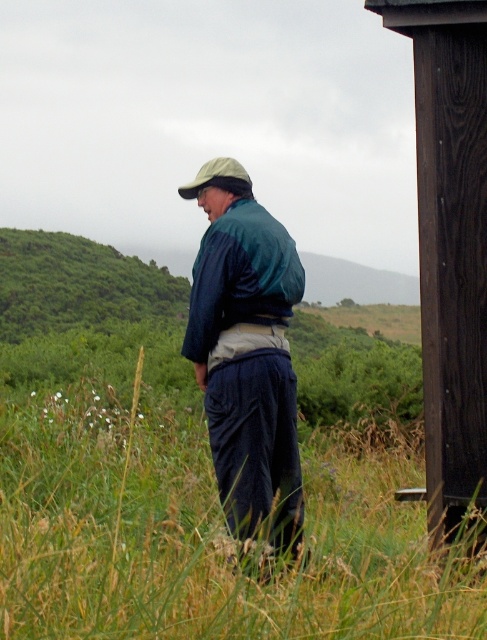
Does green grass at center have a smaller size compared to green fabric jacket at center?

Indeed, green grass at center has a smaller size compared to green fabric jacket at center.

Can you confirm if green grass at center is positioned to the right of green fabric jacket at center?

Incorrect, green grass at center is not on the right side of green fabric jacket at center.

At what (x,y) coordinates should I click in order to perform the action: click on green grass at center. Please return your answer as a coordinate pair (x, y). Looking at the image, I should click on (202, 532).

Describe the element at coordinates (449, 243) in the screenshot. I see `dark brown wood post at right` at that location.

Locate an element on the screen. This screenshot has width=487, height=640. dark brown wood post at right is located at coordinates (449, 243).

Is point (200, 262) positioned after point (226, 166)?

No, it is in front of (226, 166).

Is green fabric jacket at center to the left of green fabric hat at upper center from the viewer's perspective?

Incorrect, green fabric jacket at center is not on the left side of green fabric hat at upper center.

Who is more forward, (242, 252) or (211, 160)?

Point (242, 252)

This screenshot has height=640, width=487. Find the location of `green fabric jacket at center`. green fabric jacket at center is located at coordinates (245, 352).